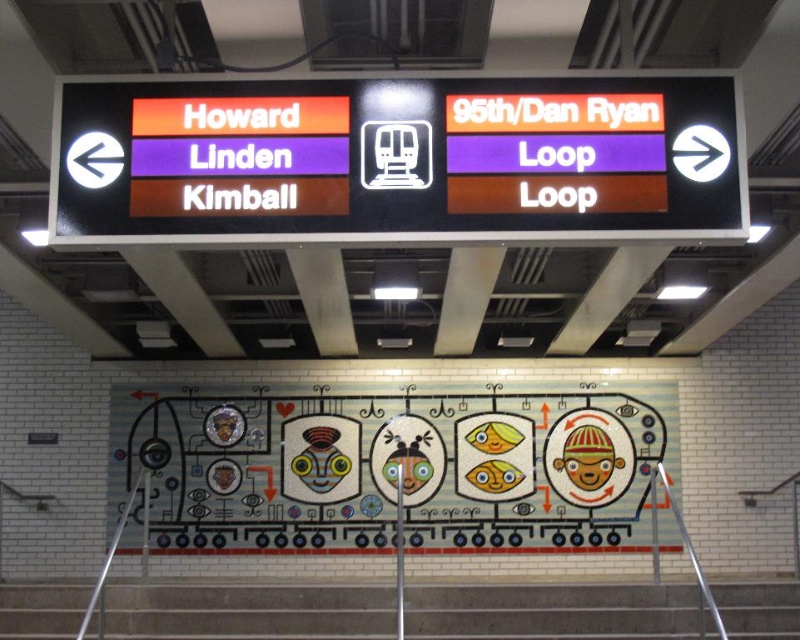
Is matte orange sign at center wider than gray concrete stairs at lower center?

Yes.

Which is more to the right, matte orange sign at center or gray concrete stairs at lower center?

Positioned to the right is matte orange sign at center.

Image resolution: width=800 pixels, height=640 pixels. What are the coordinates of `matte orange sign at center` in the screenshot? It's located at tap(398, 160).